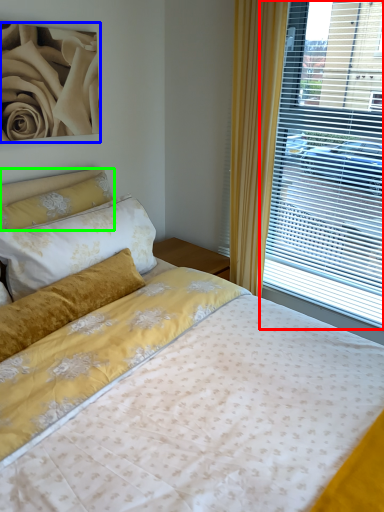
Question: Based on their relative distances, which object is farther from window (highlighted by a red box)? Choose from rose (highlighted by a blue box) and pillow (highlighted by a green box).

Choices:
 (A) rose
 (B) pillow

Answer: (A)